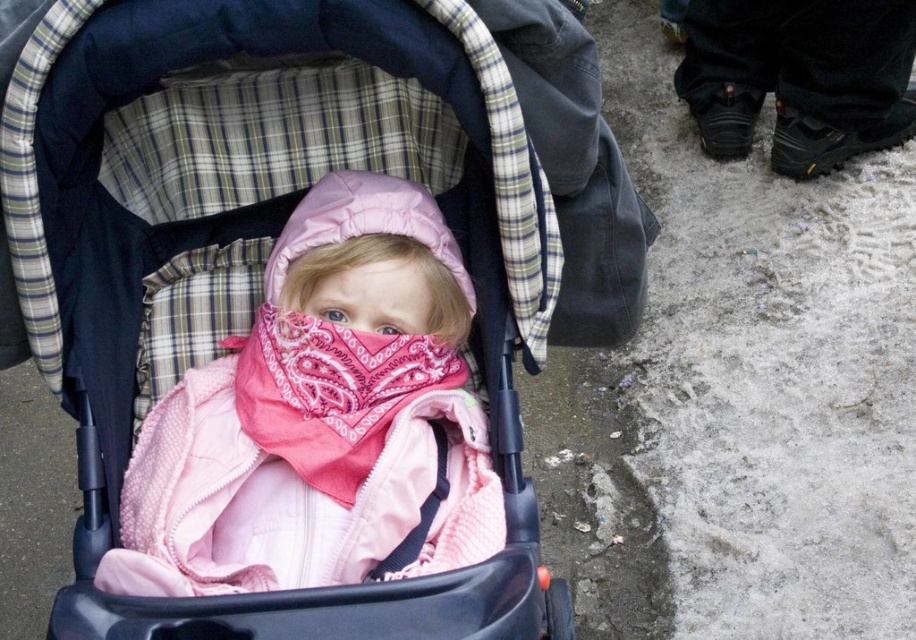
Between point (500, 131) and point (308, 416), which one is positioned behind?

Positioned behind is point (308, 416).

Which is below, matte pink fabric baby carriage at center or pink quilted jacket at center?

Positioned lower is pink quilted jacket at center.

Is point (455, 104) positioned before point (264, 273)?

Yes, it is in front of point (264, 273).

Find the location of `matte pink fabric baby carriage at center`. matte pink fabric baby carriage at center is located at coordinates (269, 275).

Which is more to the left, pink quilted jacket at center or pink paisley scarf at center?

From the viewer's perspective, pink paisley scarf at center appears more on the left side.

Find the location of a particular element. This screenshot has width=916, height=640. pink quilted jacket at center is located at coordinates (320, 417).

In order to click on pink quilted jacket at center in this screenshot , I will do `click(320, 417)`.

Can you confirm if matte pink fabric baby carriage at center is smaller than pink paisley scarf at center?

Incorrect, matte pink fabric baby carriage at center is not smaller in size than pink paisley scarf at center.

Does matte pink fabric baby carriage at center lie in front of pink paisley scarf at center?

That is True.

Between point (275, 605) and point (420, 342), which one is positioned behind?

The point (420, 342) is more distant.

The width and height of the screenshot is (916, 640). Identify the location of matte pink fabric baby carriage at center. (269, 275).